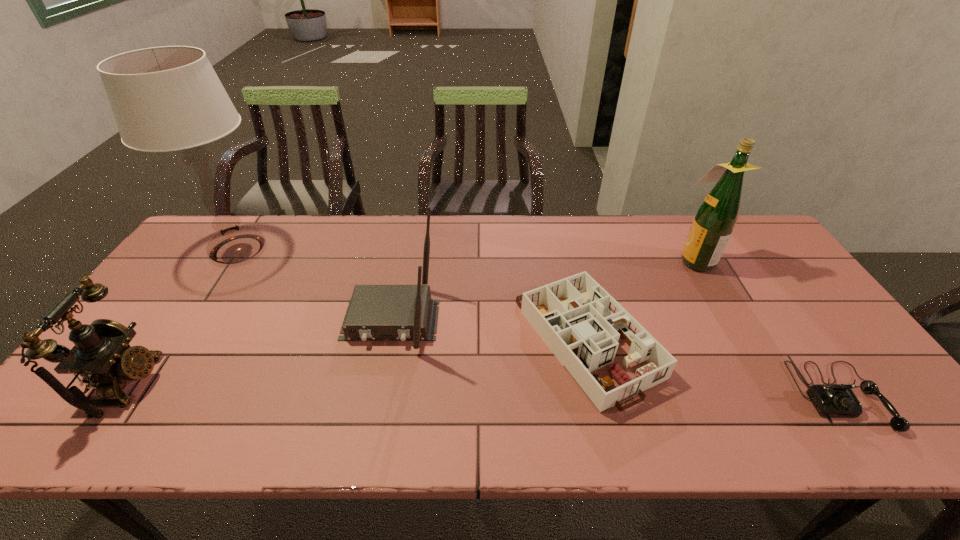
Where is `empty space between the tallest object and the liquor`? The width and height of the screenshot is (960, 540). empty space between the tallest object and the liquor is located at coordinates pos(467,255).

This screenshot has height=540, width=960. In order to click on free space between the left telephone and the third object from right to left in this screenshot , I will do `click(356, 361)`.

You are a GUI agent. You are given a task and a screenshot of the screen. Output one action in this format:
    pyautogui.click(x=<x>, y=<y>)
    Task: Click on the unoccupied position between the taller telephone and the dollhouse
    Image resolution: width=960 pixels, height=540 pixels.
    Given the screenshot: What is the action you would take?
    pyautogui.click(x=356, y=361)

Image resolution: width=960 pixels, height=540 pixels. What are the coordinates of `free space between the fifth shortest object and the rightmost object` in the screenshot? It's located at (767, 328).

Where is `vacant region between the fourth object from right to left and the tallest object`? vacant region between the fourth object from right to left and the tallest object is located at coordinates (315, 285).

This screenshot has height=540, width=960. I want to click on vacant region between the third object from left to right and the taller telephone, so click(258, 352).

This screenshot has width=960, height=540. In order to click on unoccupied position between the taller telephone and the router in this screenshot , I will do `click(258, 352)`.

Where is `vacant area between the fifth shortest object and the third object from right to left`? Image resolution: width=960 pixels, height=540 pixels. vacant area between the fifth shortest object and the third object from right to left is located at coordinates (640, 299).

Locate an element on the screen. This screenshot has width=960, height=540. free space that is in between the left telephone and the right telephone is located at coordinates (483, 390).

Where is `object that is the second closest to the third object from right to left`? The height and width of the screenshot is (540, 960). object that is the second closest to the third object from right to left is located at coordinates (400, 312).